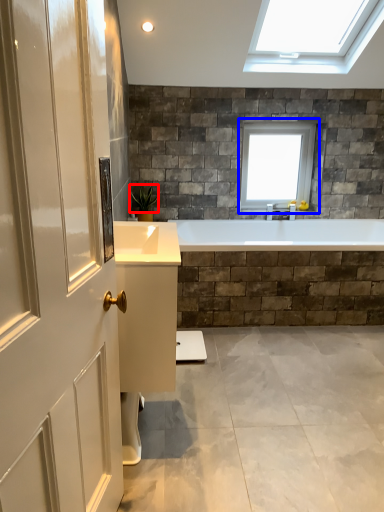
Question: Which object is further to the camera taking this photo, plant (highlighted by a red box) or window (highlighted by a blue box)?

Choices:
 (A) plant
 (B) window

Answer: (B)